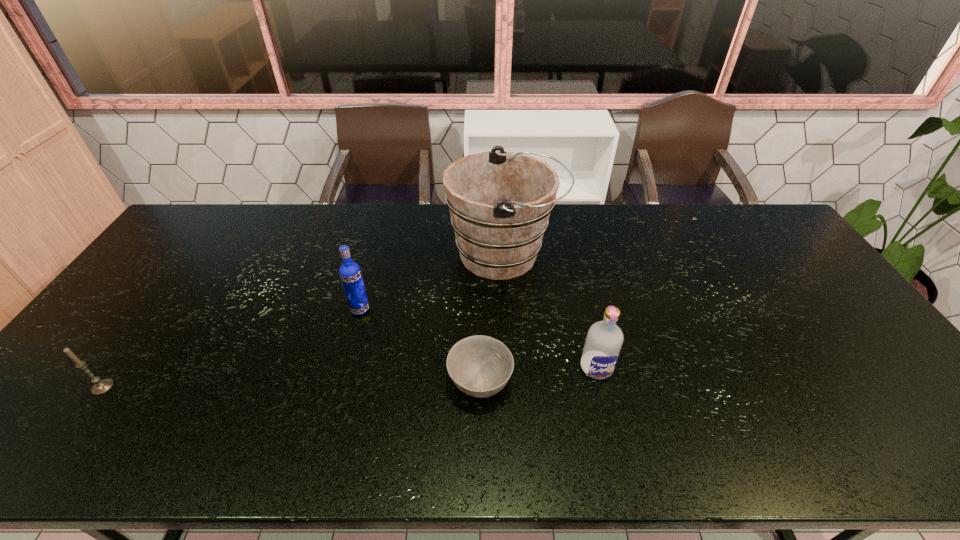
The image size is (960, 540). I want to click on free area in between the bucket and the shortest object, so click(x=492, y=320).

Find the location of a particular element. The width and height of the screenshot is (960, 540). free space between the right vodka and the farthest object is located at coordinates (550, 311).

You are a GUI agent. You are given a task and a screenshot of the screen. Output one action in this format:
    pyautogui.click(x=<x>, y=<y>)
    Task: Click on the vacant space that's between the fourth nearest object and the tallest object
    Image resolution: width=960 pixels, height=540 pixels.
    Given the screenshot: What is the action you would take?
    pyautogui.click(x=432, y=282)

This screenshot has height=540, width=960. I want to click on empty space between the tallest object and the right vodka, so click(550, 311).

Find the location of a particular element. blank region between the fourth tallest object and the shortest object is located at coordinates (292, 386).

Where is `vacant region between the shortest object and the fourth tallest object`? The width and height of the screenshot is (960, 540). vacant region between the shortest object and the fourth tallest object is located at coordinates (292, 386).

Find the location of a particular element. This screenshot has width=960, height=540. free spot between the shortest object and the farthest object is located at coordinates (492, 320).

Locate an element on the screen. The height and width of the screenshot is (540, 960). free spot between the right vodka and the bowl is located at coordinates (539, 376).

Locate an element on the screen. The width and height of the screenshot is (960, 540). empty space between the bowl and the nearer vodka is located at coordinates (539, 376).

This screenshot has width=960, height=540. Find the location of `vacant space in between the second farthest object and the leftmost object`. vacant space in between the second farthest object and the leftmost object is located at coordinates (231, 348).